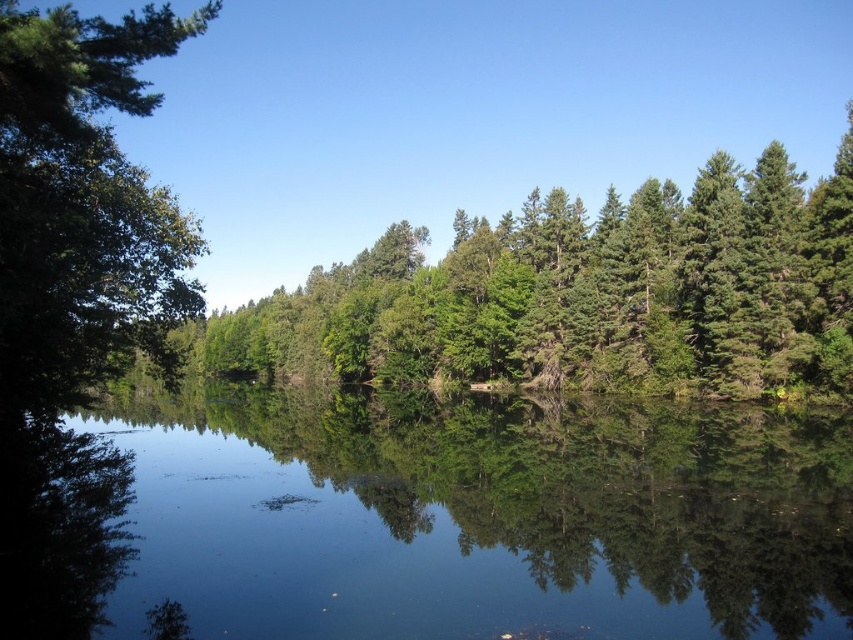
Based on the photo, can you confirm if transparent water at center is positioned to the left of green leafy trees at upper center?

Yes, transparent water at center is to the left of green leafy trees at upper center.

Does transparent water at center appear under green leafy trees at upper center?

Correct, transparent water at center is located below green leafy trees at upper center.

Measure the distance between transparent water at center and camera.

A distance of 9.17 meters exists between transparent water at center and camera.

Where is `transparent water at center`? The width and height of the screenshot is (853, 640). transparent water at center is located at coordinates (477, 516).

Based on the photo, is green leafy trees at upper center shorter than green leafy tree at left?

Yes.

Is point (639, 257) positioned in front of point (94, 275)?

No, it is behind (94, 275).

Which is behind, point (469, 298) or point (70, 465)?

Positioned behind is point (469, 298).

This screenshot has width=853, height=640. I want to click on green leafy trees at upper center, so click(589, 294).

Between point (277, 416) and point (28, 289), which one is positioned behind?

The point (277, 416) is more distant.

Does transparent water at center have a larger size compared to green leafy tree at left?

Incorrect, transparent water at center is not larger than green leafy tree at left.

Which is behind, point (693, 444) or point (49, 230)?

The point (693, 444) is more distant.

Where is `transparent water at center`? This screenshot has width=853, height=640. transparent water at center is located at coordinates (477, 516).